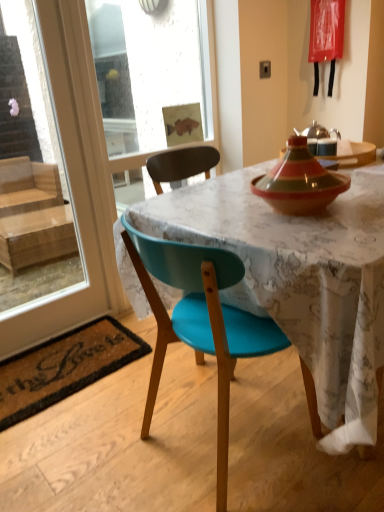
Question: Does matte ceramic tagine at upper right contain teal plastic chair at center?

Choices:
 (A) no
 (B) yes

Answer: (A)

Question: Considering the relative sizes of matte ceramic tagine at upper right and teal plastic chair at center in the image provided, is matte ceramic tagine at upper right smaller than teal plastic chair at center?

Choices:
 (A) no
 (B) yes

Answer: (B)

Question: From the image's perspective, is matte ceramic tagine at upper right above teal plastic chair at center?

Choices:
 (A) yes
 (B) no

Answer: (A)

Question: Would you consider matte ceramic tagine at upper right to be distant from teal plastic chair at center?

Choices:
 (A) yes
 (B) no

Answer: (B)

Question: Does matte ceramic tagine at upper right have a greater width compared to teal plastic chair at center?

Choices:
 (A) no
 (B) yes

Answer: (A)

Question: In terms of width, does transparent glass screen door at upper left look wider or thinner when compared to matte ceramic tagine at upper right?

Choices:
 (A) thin
 (B) wide

Answer: (A)

Question: From a real-world perspective, is transparent glass screen door at upper left positioned above or below matte ceramic tagine at upper right?

Choices:
 (A) below
 (B) above

Answer: (A)

Question: From the image's perspective, is transparent glass screen door at upper left located above or below matte ceramic tagine at upper right?

Choices:
 (A) above
 (B) below

Answer: (B)

Question: Is transparent glass screen door at upper left taller or shorter than matte ceramic tagine at upper right?

Choices:
 (A) tall
 (B) short

Answer: (A)

Question: Is transparent glass screen door at upper left wider or thinner than transparent glass door at left?

Choices:
 (A) wide
 (B) thin

Answer: (B)

Question: Looking at the image, does transparent glass screen door at upper left seem bigger or smaller compared to transparent glass door at left?

Choices:
 (A) small
 (B) big

Answer: (B)

Question: From the image's perspective, is transparent glass screen door at upper left above or below transparent glass door at left?

Choices:
 (A) below
 (B) above

Answer: (B)

Question: Is point pos(160,68) positioned closer to the camera than point pos(67,205)?

Choices:
 (A) closer
 (B) farther

Answer: (B)

Question: Does point (347, 139) appear closer or farther from the camera than point (135, 349)?

Choices:
 (A) closer
 (B) farther

Answer: (B)

Question: In the image, is matte ceramic tagine at upper right positioned in front of or behind coir mat at lower left?

Choices:
 (A) front
 (B) behind

Answer: (B)